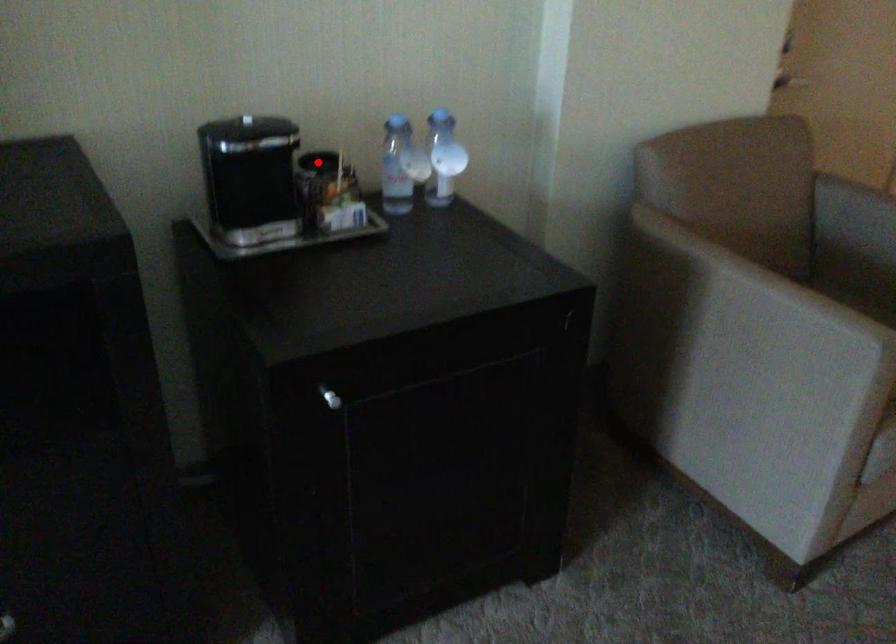
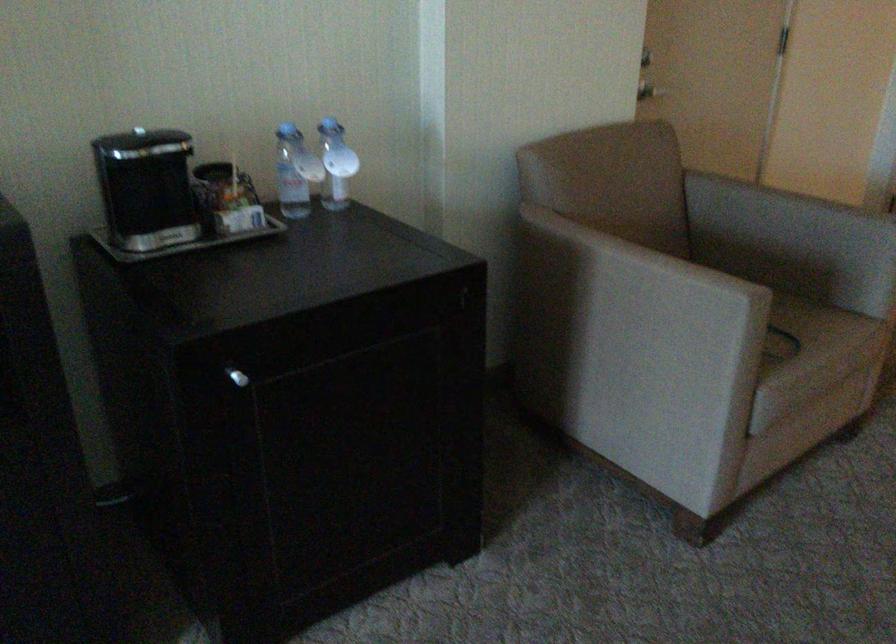
Locate, in the second image, the point that corresponds to the highlighted location in the first image.

(212, 171)